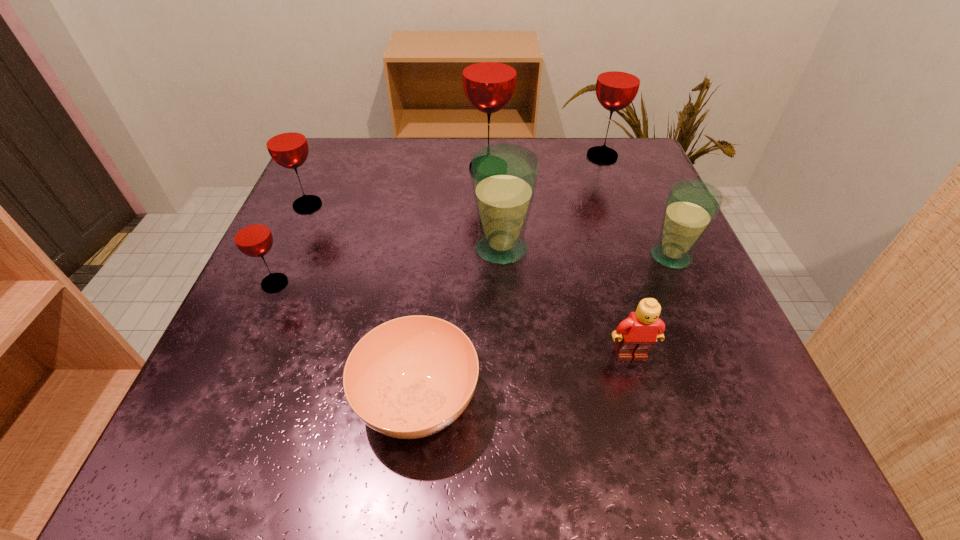
Where is `vacant space at the near left corner`? The width and height of the screenshot is (960, 540). vacant space at the near left corner is located at coordinates (292, 422).

What are the coordinates of `vacant space at the far right corner of the desktop` in the screenshot? It's located at (610, 140).

Locate an element on the screen. vacant space at the near right corner is located at coordinates pyautogui.click(x=791, y=477).

Where is `free spot between the right blue glass and the second biggest red glass`? The width and height of the screenshot is (960, 540). free spot between the right blue glass and the second biggest red glass is located at coordinates (636, 206).

At what (x,y) coordinates should I click in order to perform the action: click on free space that is in between the smaller blue glass and the biggest red glass. Please return your answer as a coordinate pair (x, y). Looking at the image, I should click on (580, 212).

This screenshot has height=540, width=960. Identify the location of free space that is in between the fourth nearest glass and the biggest red glass. (397, 186).

The image size is (960, 540). I want to click on blank region between the bigger blue glass and the third farthest glass, so click(x=404, y=227).

You are a GUI agent. You are given a task and a screenshot of the screen. Output one action in this format:
    pyautogui.click(x=<x>, y=<y>)
    Task: Click on the empty space between the shortest object and the left blue glass
    The width and height of the screenshot is (960, 540).
    Given the screenshot: What is the action you would take?
    pyautogui.click(x=460, y=325)

You are a GUI agent. You are given a task and a screenshot of the screen. Output one action in this format:
    pyautogui.click(x=<x>, y=<y>)
    Task: Click on the empty space that is in between the left blue glass and the smallest red glass
    Image resolution: width=960 pixels, height=540 pixels.
    Given the screenshot: What is the action you would take?
    pyautogui.click(x=388, y=266)

At what (x,y) coordinates should I click in order to perform the action: click on free space between the left blue glass and the right blue glass. Please return your answer as a coordinate pair (x, y). Looking at the image, I should click on (586, 253).